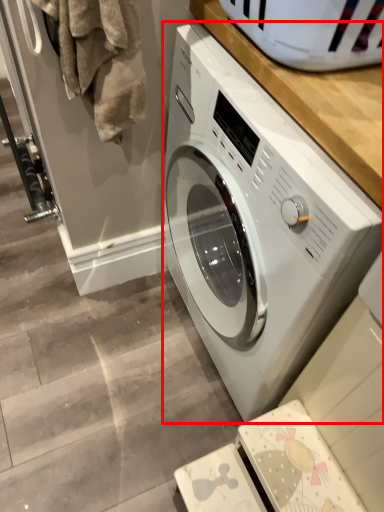
Question: From the image, what is the correct spatial relationship of washing machine (annotated by the red box) in relation to laundry?

Choices:
 (A) left
 (B) right

Answer: (B)